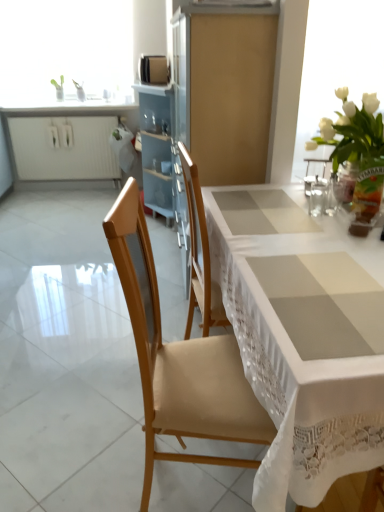
Question: Could you tell me if satin gold microwave at upper center is facing white lace tablecloth at center?

Choices:
 (A) no
 (B) yes

Answer: (A)

Question: Is satin gold microwave at upper center turned away from white lace tablecloth at center?

Choices:
 (A) no
 (B) yes

Answer: (A)

Question: Is satin gold microwave at upper center behind white lace tablecloth at center?

Choices:
 (A) yes
 (B) no

Answer: (A)

Question: Can you confirm if satin gold microwave at upper center is bigger than white lace tablecloth at center?

Choices:
 (A) no
 (B) yes

Answer: (A)

Question: Would you say satin gold microwave at upper center contains white lace tablecloth at center?

Choices:
 (A) yes
 (B) no

Answer: (B)

Question: Is satin gold microwave at upper center thinner than white lace tablecloth at center?

Choices:
 (A) yes
 (B) no

Answer: (A)

Question: From a real-world perspective, is wooden chair at center physically above white lace tablecloth at center?

Choices:
 (A) yes
 (B) no

Answer: (A)

Question: Is wooden chair at center smaller than white lace tablecloth at center?

Choices:
 (A) no
 (B) yes

Answer: (B)

Question: Are wooden chair at center and white lace tablecloth at center located far from each other?

Choices:
 (A) no
 (B) yes

Answer: (A)

Question: Does wooden chair at center have a lesser width compared to white lace tablecloth at center?

Choices:
 (A) no
 (B) yes

Answer: (B)

Question: Is wooden chair at center completely or partially outside of white lace tablecloth at center?

Choices:
 (A) no
 (B) yes

Answer: (A)

Question: Are wooden chair at center and white lace tablecloth at center beside each other?

Choices:
 (A) yes
 (B) no

Answer: (B)

Question: Is white lace tablecloth at center further to the viewer compared to clear glass water at upper right?

Choices:
 (A) no
 (B) yes

Answer: (A)